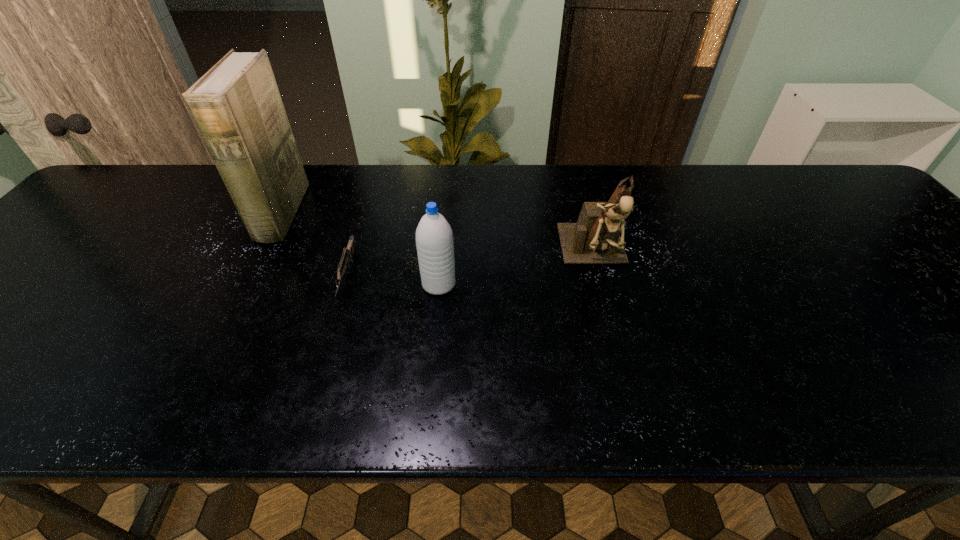
The image size is (960, 540). What are the coordinates of `vacant position in the image that satisfies the following two spatial constraints: 1. aimed along the barrel of the third object from left to right; 2. on the left side of the shortest object` in the screenshot? It's located at (346, 284).

I want to click on free point that satisfies the following two spatial constraints: 1. aimed along the barrel of the shortest object; 2. on the left side of the water bottle, so click(346, 284).